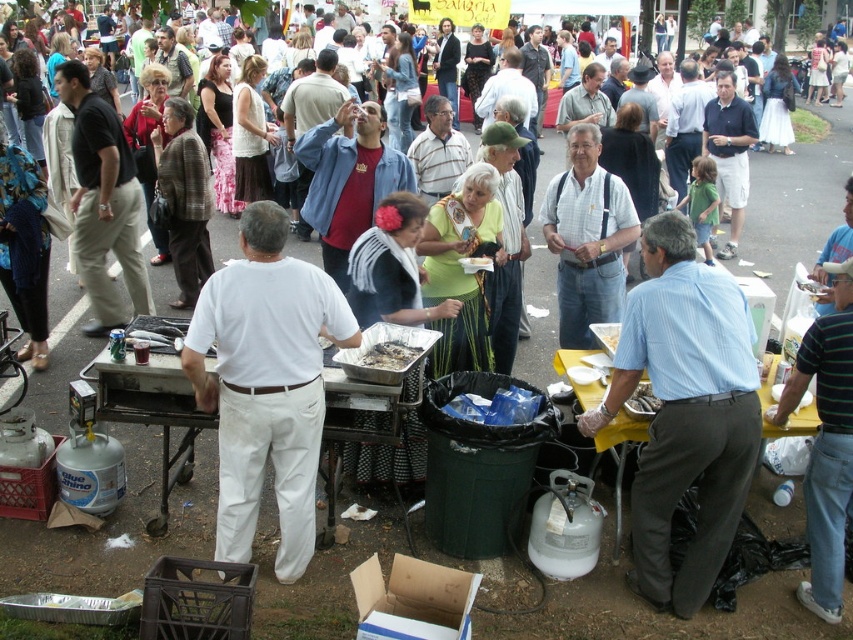
You are standing at the event and want to ask the person in the light blue striped shirt at center for a sample of their dish. Considering that the average comfortable conversational distance is between 1 to 2 meters, can you approach them directly without needing to adjust your position?

The light blue striped shirt at center is 3.65 meters away from you. Since the comfortable conversational distance is 1 to 2 meters, you are currently too far away to converse comfortably. You would need to move closer to reduce the distance to within the recommended range.

You are at the festival and want to take a photo of the light blue striped shirt at center and the shiny silver tray at center. Which one will appear larger in your photo?

The light blue striped shirt at center will appear larger in the photo because it is closer to the viewer than the shiny silver tray at center.

You are at the festival and want to grab food from the shiny silver tray at center. However, there is a charcoal gray metal grill at center in the way. Can you reach the tray without moving the grill?

The charcoal gray metal grill at center is located below the shiny silver tray at center, so you can reach the tray without moving the grill since it is positioned above the grill.